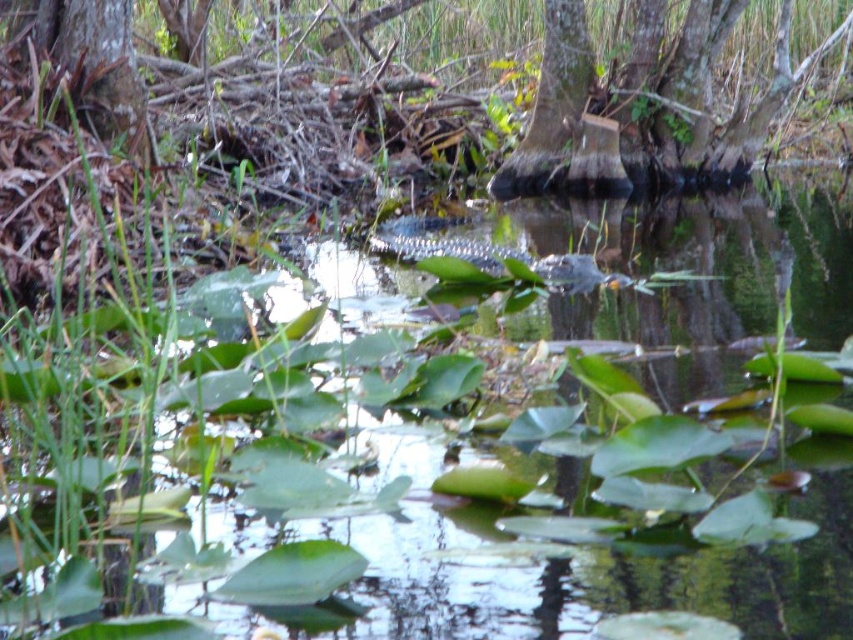
Is green glossy water at center taller than smooth bark tree at center?

No.

Consider the image. Can you confirm if green glossy water at center is shorter than smooth bark tree at center?

Indeed, green glossy water at center has a lesser height compared to smooth bark tree at center.

You are a GUI agent. You are given a task and a screenshot of the screen. Output one action in this format:
    pyautogui.click(x=<x>, y=<y>)
    Task: Click on the green glossy water at center
    The image size is (853, 640).
    Given the screenshot: What is the action you would take?
    pyautogui.click(x=436, y=451)